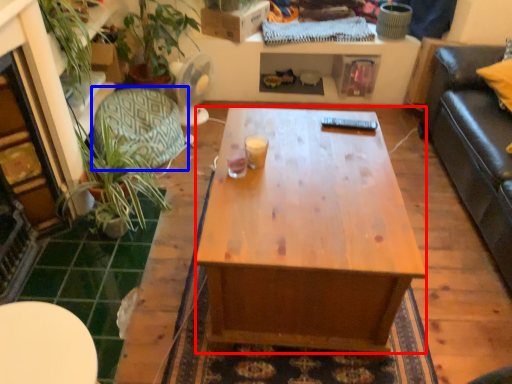
Question: Among these objects, which one is nearest to the camera, desk (highlighted by a red box) or swivel chair (highlighted by a blue box)?

Choices:
 (A) desk
 (B) swivel chair

Answer: (A)